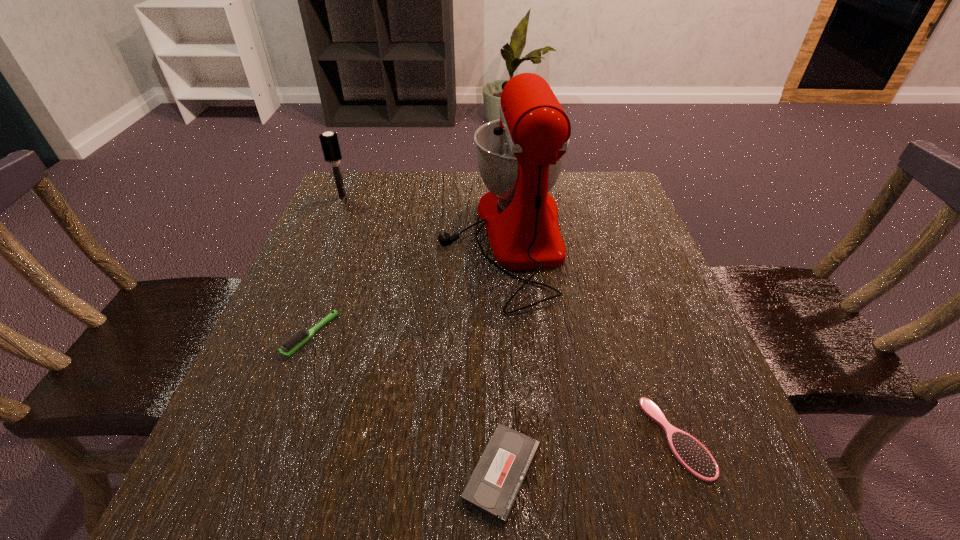
The width and height of the screenshot is (960, 540). What are the coordinates of `hairbrush object that ranks as the second closest to the mixer` in the screenshot? It's located at (693, 456).

Identify which hairbrush is the nearest to the farthest hairbrush. Please provide its 2D coordinates. Your answer should be formatted as a tuple, i.e. [(x, y)], where the tuple contains the x and y coordinates of a point satisfying the conditions above.

[(293, 343)]

Locate an element on the screen. This screenshot has width=960, height=540. vacant space that satisfies the following two spatial constraints: 1. on the bowl side of the tallest object; 2. on the right side of the nearest hairbrush is located at coordinates (516, 437).

Where is `vacant area that satisfies the following two spatial constraints: 1. on the bowl side of the shortest hairbrush; 2. on the right side of the mixer`? vacant area that satisfies the following two spatial constraints: 1. on the bowl side of the shortest hairbrush; 2. on the right side of the mixer is located at coordinates (516, 437).

Locate an element on the screen. The image size is (960, 540). free spot that satisfies the following two spatial constraints: 1. on the bowl side of the mixer; 2. on the back side of the rightmost hairbrush is located at coordinates (516, 437).

You are a GUI agent. You are given a task and a screenshot of the screen. Output one action in this format:
    pyautogui.click(x=<x>, y=<y>)
    Task: Click on the free location that satisfies the following two spatial constraints: 1. on the bowl side of the mixer; 2. on the left side of the shortest hairbrush
    The width and height of the screenshot is (960, 540).
    Given the screenshot: What is the action you would take?
    pyautogui.click(x=516, y=437)

Image resolution: width=960 pixels, height=540 pixels. I want to click on free spot that satisfies the following two spatial constraints: 1. on the bowl side of the tallest object; 2. on the left side of the shortest hairbrush, so click(516, 437).

Find the location of a particular element. The image size is (960, 540). free space that satisfies the following two spatial constraints: 1. on the bowl side of the nearest hairbrush; 2. on the right side of the tallest object is located at coordinates (516, 437).